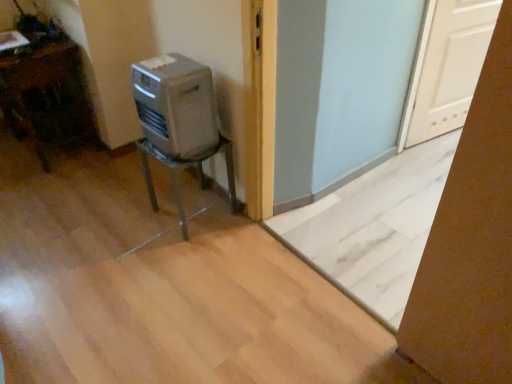
This screenshot has width=512, height=384. Identify the location of blank area beneath metallic gray chair at center-left, which appears as the 2th furniture when viewed from the left (from a real-world perspective). (197, 212).